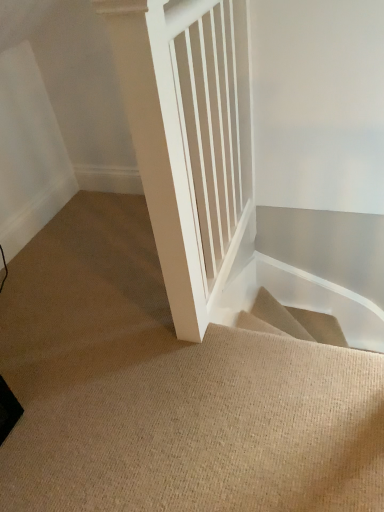
Where is `white smooth wooden pillar at center`? white smooth wooden pillar at center is located at coordinates (159, 152).

Describe the element at coordinates (159, 152) in the screenshot. The height and width of the screenshot is (512, 384). I see `white smooth wooden pillar at center` at that location.

I want to click on beige carpeted stairs at center, so click(x=168, y=390).

What do you see at coordinates (168, 390) in the screenshot? The image size is (384, 512). I see `beige carpeted stairs at center` at bounding box center [168, 390].

At what (x,y) coordinates should I click in order to perform the action: click on white smooth wooden pillar at center. Please return your answer as a coordinate pair (x, y). This screenshot has width=384, height=512. Looking at the image, I should click on (159, 152).

Which object is positioned more to the left, white smooth wooden pillar at center or beige carpeted stairs at center?

beige carpeted stairs at center.

Which is behind, white smooth wooden pillar at center or beige carpeted stairs at center?

Positioned behind is beige carpeted stairs at center.

Consider the image. Which is less distant, (182, 184) or (126, 422)?

The point (182, 184) is in front.

From the image's perspective, between white smooth wooden pillar at center and beige carpeted stairs at center, who is located below?

beige carpeted stairs at center is shown below in the image.

From a real-world perspective, between white smooth wooden pillar at center and beige carpeted stairs at center, who is vertically higher?

In real-world perspective, white smooth wooden pillar at center is above.

Does white smooth wooden pillar at center have a lesser width compared to beige carpeted stairs at center?

Yes, white smooth wooden pillar at center is thinner than beige carpeted stairs at center.

In terms of height, does white smooth wooden pillar at center look taller or shorter compared to beige carpeted stairs at center?

white smooth wooden pillar at center is taller than beige carpeted stairs at center.

In terms of size, does white smooth wooden pillar at center appear bigger or smaller than beige carpeted stairs at center?

Clearly, white smooth wooden pillar at center is larger in size than beige carpeted stairs at center.

Is white smooth wooden pillar at center located outside beige carpeted stairs at center?

Yes.

Is white smooth wooden pillar at center directly adjacent to beige carpeted stairs at center?

No, white smooth wooden pillar at center is not beside beige carpeted stairs at center.

Is white smooth wooden pillar at center turned away from beige carpeted stairs at center?

Yes, white smooth wooden pillar at center's orientation is away from beige carpeted stairs at center.

In order to click on pillar lying on the right of beige carpeted stairs at center in this screenshot , I will do `click(159, 152)`.

Which is more to the right, beige carpeted stairs at center or white smooth wooden pillar at center?

From the viewer's perspective, white smooth wooden pillar at center appears more on the right side.

In the image, is beige carpeted stairs at center positioned in front of or behind white smooth wooden pillar at center?

Clearly, beige carpeted stairs at center is behind white smooth wooden pillar at center.

Which is behind, point (145, 211) or point (142, 1)?

The point (145, 211) is farther from the camera.

From the image's perspective, who appears lower, beige carpeted stairs at center or white smooth wooden pillar at center?

From the image's view, beige carpeted stairs at center is below.

From a real-world perspective, which object stands above the other?

white smooth wooden pillar at center.

Does beige carpeted stairs at center have a lesser width compared to white smooth wooden pillar at center?

No, beige carpeted stairs at center is not thinner than white smooth wooden pillar at center.

Considering the sizes of objects beige carpeted stairs at center and white smooth wooden pillar at center in the image provided, who is taller, beige carpeted stairs at center or white smooth wooden pillar at center?

With more height is white smooth wooden pillar at center.

Which of these two, beige carpeted stairs at center or white smooth wooden pillar at center, is smaller?

beige carpeted stairs at center is smaller.

Consider the image. Is beige carpeted stairs at center completely or partially outside of white smooth wooden pillar at center?

Absolutely, beige carpeted stairs at center is external to white smooth wooden pillar at center.

Is beige carpeted stairs at center directly adjacent to white smooth wooden pillar at center?

They are not placed beside each other.

Could you tell me if beige carpeted stairs at center is facing white smooth wooden pillar at center?

No, beige carpeted stairs at center is not oriented towards white smooth wooden pillar at center.

Identify the location of pillar in front of the beige carpeted stairs at center. (159, 152).

Identify the location of pillar in front of the beige carpeted stairs at center. The width and height of the screenshot is (384, 512). (159, 152).

Locate an element on the screen. pillar above the beige carpeted stairs at center (from a real-world perspective) is located at coordinates (159, 152).